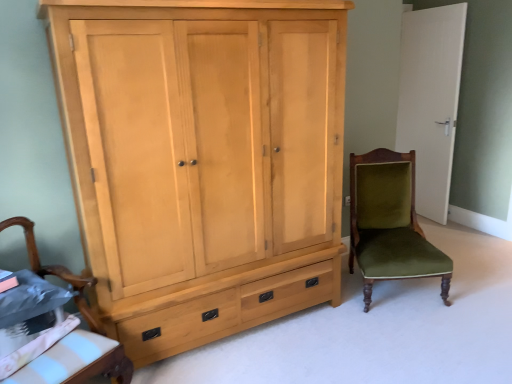
Locate an element on the screen. free spot above white matte door at upper right (from a real-world perspective) is located at coordinates (436, 5).